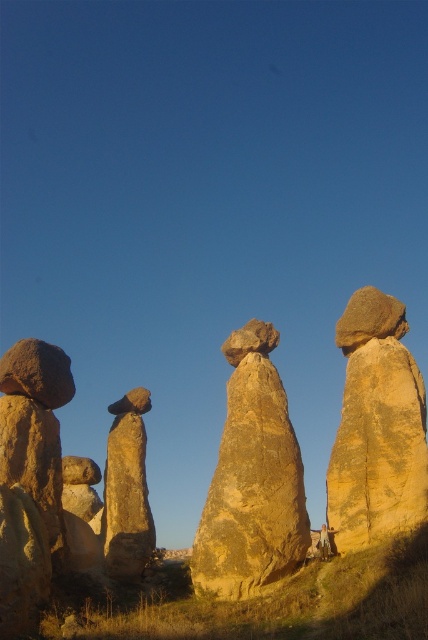
Consider the image. You are standing in front of the hoodoo formations and want to take a photo that includes both point (104, 484) and point (115, 524). Which point should you position closer to the camera to ensure both are in focus?

Point (104, 484) is already closer to the camera than point (115, 524). To ensure both are in focus, position the camera so that point (104, 484) is closer to the camera, maintaining their natural positions.

You are standing in front of the hoodoo formations and want to determine the relative positions of two points marked in the scene. Which of the two points, point (237, 548) or point (341, 460), is closer to you?

Point (237, 548) is closer to the viewer than point (341, 460).

You are standing in the middle of the natural landscape and want to take a photo of the yellowish sandstone rock formation at center. Where should you position yourself to capture it in the frame?

The yellowish sandstone rock formation at center is located at coordinates (253,486), so you should position yourself facing that point to capture it in the frame.